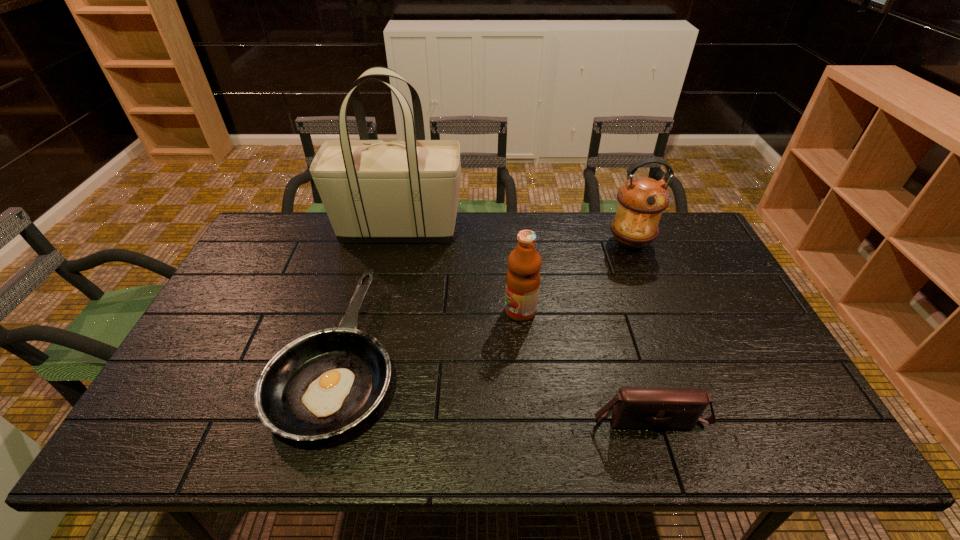
Identify the location of vacant space situated on the back of the frying pan. (372, 240).

You are a GUI agent. You are given a task and a screenshot of the screen. Output one action in this format:
    pyautogui.click(x=<x>, y=<y>)
    Task: Click on the shopping bag that is at the far edge
    
    Given the screenshot: What is the action you would take?
    pyautogui.click(x=374, y=191)

You are a GUI agent. You are given a task and a screenshot of the screen. Output one action in this format:
    pyautogui.click(x=<x>, y=<y>)
    Task: Click on the oil lamp that is at the far edge
    The width and height of the screenshot is (960, 540).
    Given the screenshot: What is the action you would take?
    pyautogui.click(x=642, y=200)

Identify the location of shoulder bag at the near edge. (634, 407).

Where is `frying pan positioned at the near edge`? Image resolution: width=960 pixels, height=540 pixels. frying pan positioned at the near edge is located at coordinates (323, 383).

The height and width of the screenshot is (540, 960). What are the coordinates of `vacant area at the far edge` in the screenshot? It's located at (564, 251).

Find the location of a particular element. This screenshot has height=540, width=960. vacant space at the near edge of the desktop is located at coordinates (638, 453).

The image size is (960, 540). I want to click on free space at the left edge, so click(x=189, y=402).

At what (x,y) coordinates should I click in order to perform the action: click on vacant space at the right edge of the desktop. Please return your answer as a coordinate pair (x, y). The image size is (960, 540). Looking at the image, I should click on (702, 306).

The image size is (960, 540). Identify the location of free area in between the fourth tallest object and the oil lamp. (639, 329).